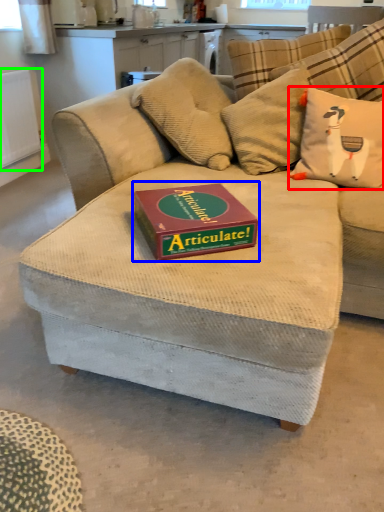
Question: Estimate the real-world distances between objects in this image. Which object is closer to throw pillow (highlighted by a red box), paperback book (highlighted by a blue box) or radiator (highlighted by a green box)?

Choices:
 (A) paperback book
 (B) radiator

Answer: (A)